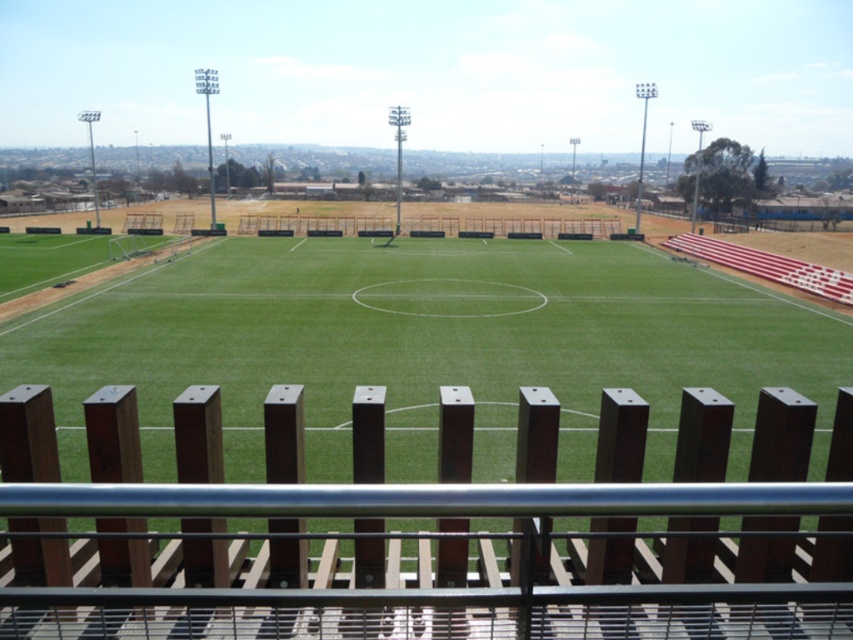
Can you confirm if brown wooden fence at center is positioned to the left of green grass football field at center?

Incorrect, brown wooden fence at center is not on the left side of green grass football field at center.

Which is more to the left, brown wooden fence at center or green grass football field at center?

green grass football field at center is more to the left.

You are a GUI agent. You are given a task and a screenshot of the screen. Output one action in this format:
    pyautogui.click(x=<x>, y=<y>)
    Task: Click on the brown wooden fence at center
    The image size is (853, 640).
    Given the screenshot: What is the action you would take?
    pyautogui.click(x=418, y=534)

Find the location of a particular element. The height and width of the screenshot is (640, 853). brown wooden fence at center is located at coordinates (418, 534).